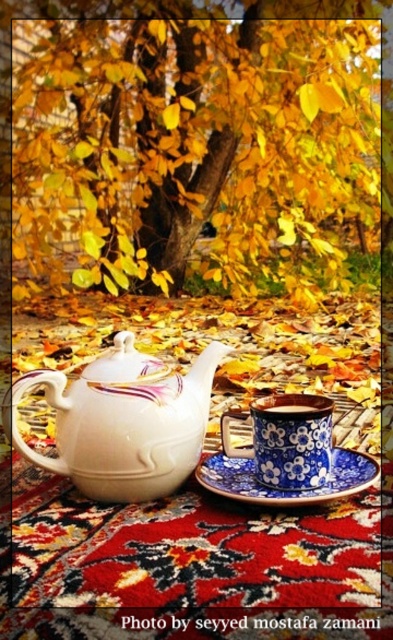
Who is more forward, (258, 412) or (284, 412)?

Point (258, 412) is more forward.

Measure the distance between blue floral ceramic cup at center and camera.

blue floral ceramic cup at center and camera are 19.06 inches apart from each other.

In order to click on blue floral ceramic cup at center in this screenshot , I will do `click(286, 442)`.

How much distance is there between white glossy teapot at center and blue ceramic cup at center?

A distance of 4.22 inches exists between white glossy teapot at center and blue ceramic cup at center.

In the scene shown: Does white glossy teapot at center have a greater height compared to blue ceramic cup at center?

Indeed, white glossy teapot at center has a greater height compared to blue ceramic cup at center.

Does point (45, 468) come in front of point (321, 403)?

Yes, it is in front of point (321, 403).

Identify the location of white glossy teapot at center. [123, 420].

The image size is (393, 640). Find the location of `yellow leaves at upper center`. yellow leaves at upper center is located at coordinates (194, 145).

Who is more distant from viewer, [27,35] or [304,408]?

The point [27,35] is more distant.

Find the location of a particular element. This screenshot has height=640, width=393. yellow leaves at upper center is located at coordinates coord(194,145).